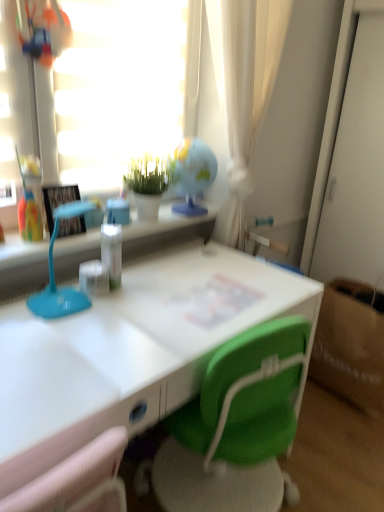
Question: Can you confirm if green matte plant at upper center is thinner than transparent glass globe at upper center?

Choices:
 (A) yes
 (B) no

Answer: (B)

Question: Is green matte plant at upper center outside transparent glass globe at upper center?

Choices:
 (A) yes
 (B) no

Answer: (A)

Question: Can you confirm if green matte plant at upper center is shorter than transparent glass globe at upper center?

Choices:
 (A) yes
 (B) no

Answer: (A)

Question: Considering the relative sizes of green matte plant at upper center and transparent glass globe at upper center in the image provided, is green matte plant at upper center bigger than transparent glass globe at upper center?

Choices:
 (A) no
 (B) yes

Answer: (A)

Question: From a real-world perspective, is green matte plant at upper center on top of transparent glass globe at upper center?

Choices:
 (A) yes
 (B) no

Answer: (B)

Question: Considering the positions of white glossy desk at center and clear plastic bottle at center in the image, is white glossy desk at center bigger or smaller than clear plastic bottle at center?

Choices:
 (A) small
 (B) big

Answer: (B)

Question: In the image, is white glossy desk at center on the left side or the right side of clear plastic bottle at center?

Choices:
 (A) left
 (B) right

Answer: (B)

Question: From a real-world perspective, is white glossy desk at center above or below clear plastic bottle at center?

Choices:
 (A) below
 (B) above

Answer: (A)

Question: Considering the positions of white glossy desk at center and clear plastic bottle at center in the image, is white glossy desk at center wider or thinner than clear plastic bottle at center?

Choices:
 (A) thin
 (B) wide

Answer: (B)

Question: In terms of size, does matte black picture frame at left appear bigger or smaller than brown paper bag at lower right?

Choices:
 (A) big
 (B) small

Answer: (B)

Question: Relative to brown paper bag at lower right, is matte black picture frame at left in front or behind?

Choices:
 (A) front
 (B) behind

Answer: (A)

Question: Visually, is matte black picture frame at left positioned to the left or to the right of brown paper bag at lower right?

Choices:
 (A) left
 (B) right

Answer: (A)

Question: Considering the positions of matte black picture frame at left and brown paper bag at lower right in the image, is matte black picture frame at left taller or shorter than brown paper bag at lower right?

Choices:
 (A) short
 (B) tall

Answer: (A)

Question: Choose the correct answer: Is green matte plant at upper center inside clear plastic bottle at center or outside it?

Choices:
 (A) outside
 (B) inside

Answer: (A)

Question: Considering the positions of green matte plant at upper center and clear plastic bottle at center in the image, is green matte plant at upper center taller or shorter than clear plastic bottle at center?

Choices:
 (A) short
 (B) tall

Answer: (B)